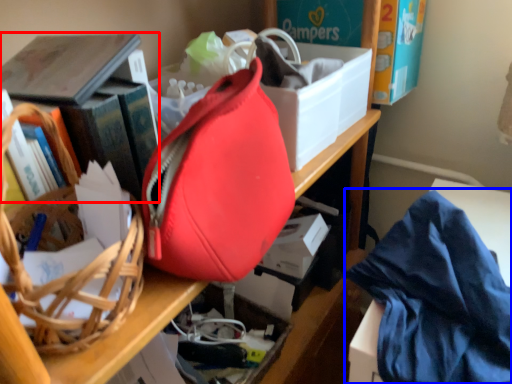
Question: Which point is closer to the camera, book (highlighted by a red box) or clothe (highlighted by a blue box)?

Choices:
 (A) book
 (B) clothe

Answer: (B)